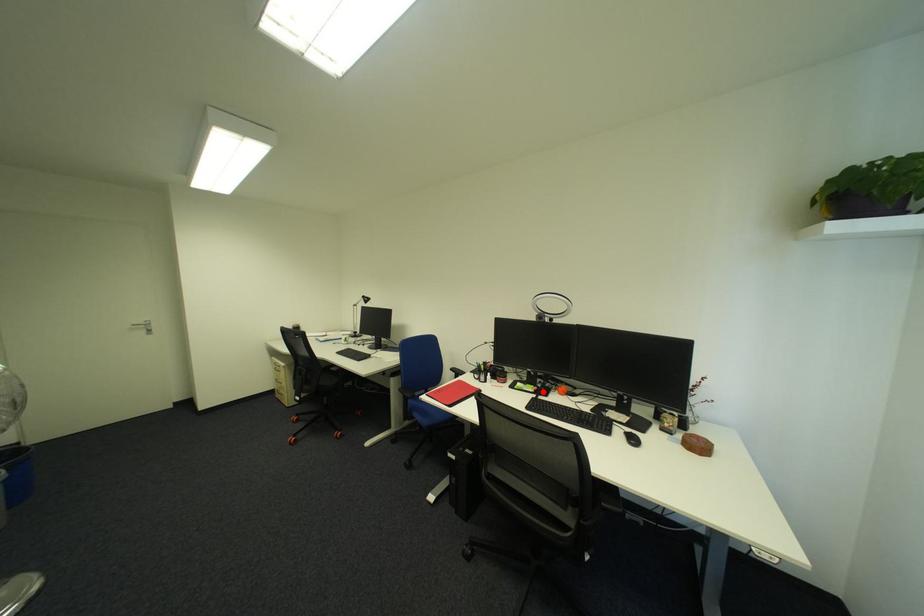
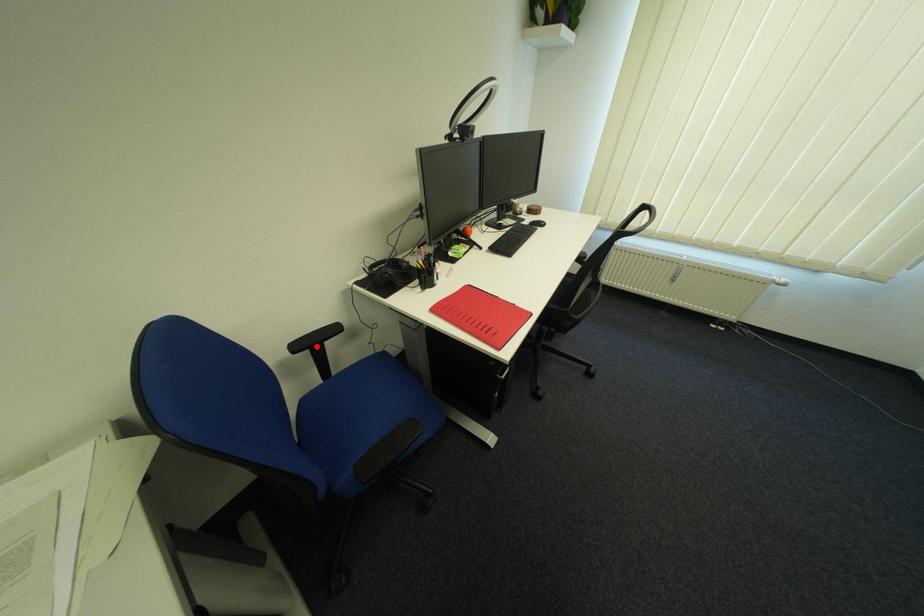
I am providing you with two images of the same scene from different viewpoints. A red point is marked on the first image and another point is marked on the second image. Does the point marked in image1 correspond to the same location as the one in image2?

No